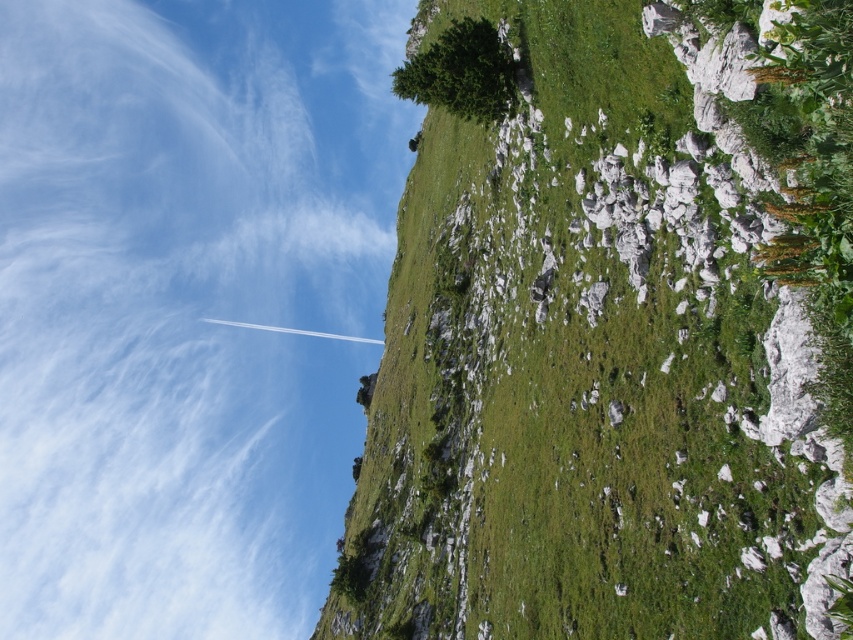
Question: Which point is closer to the camera taking this photo?

Choices:
 (A) (151, 38)
 (B) (665, 8)

Answer: (B)

Question: Which object appears farthest from the camera in this image?

Choices:
 (A) white fluffy cloud at upper left
 (B) green grassy hillside at upper center

Answer: (A)

Question: Can you confirm if green grassy hillside at upper center is positioned below white fluffy cloud at upper left?

Choices:
 (A) yes
 (B) no

Answer: (A)

Question: Can you confirm if green grassy hillside at upper center is thinner than white fluffy cloud at upper left?

Choices:
 (A) yes
 (B) no

Answer: (A)

Question: Does green grassy hillside at upper center appear over white fluffy cloud at upper left?

Choices:
 (A) no
 (B) yes

Answer: (A)

Question: Which point appears farthest from the camera in this image?

Choices:
 (A) (181, 381)
 (B) (477, 125)

Answer: (A)